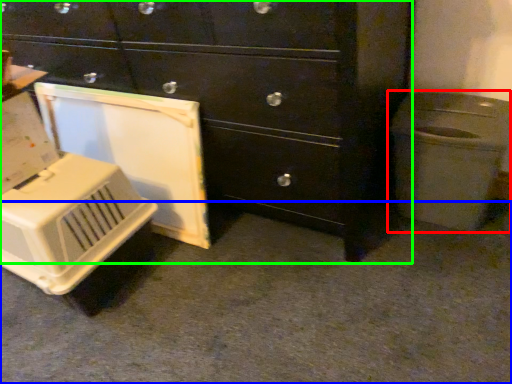
Question: Which object is the farthest from waste container (highlighted by a red box)? Choose among these: concrete (highlighted by a blue box) or chest of drawers (highlighted by a green box).

Choices:
 (A) concrete
 (B) chest of drawers

Answer: (A)